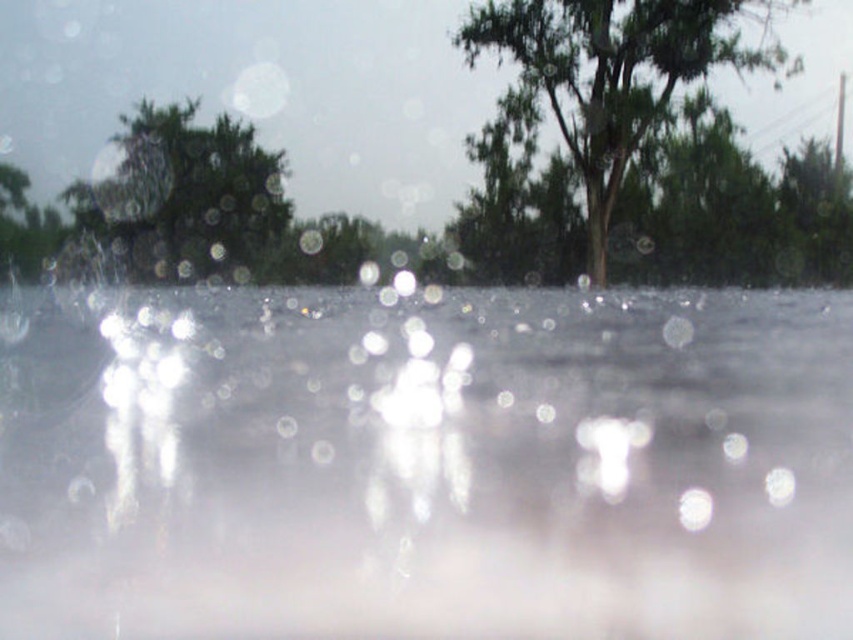
Which of these two, transparent water at center or green matte tree at upper left, stands shorter?

transparent water at center

Can you confirm if transparent water at center is positioned to the left of green matte tree at upper left?

No, transparent water at center is not to the left of green matte tree at upper left.

This screenshot has height=640, width=853. What do you see at coordinates (425, 465) in the screenshot? I see `transparent water at center` at bounding box center [425, 465].

Find the location of a particular element. transparent water at center is located at coordinates (425, 465).

Is transparent water at center below green leafy tree at upper center?

Correct, transparent water at center is located below green leafy tree at upper center.

Which is in front, point (123, 584) or point (585, 76)?

Point (123, 584) is more forward.

Find the location of `transparent water at center`. transparent water at center is located at coordinates (425, 465).

Can you confirm if green leafy tree at upper center is thinner than green matte tree at upper left?

No, green leafy tree at upper center is not thinner than green matte tree at upper left.

Is point (595, 97) positioned behind point (142, 256)?

No, (595, 97) is in front of (142, 256).

This screenshot has height=640, width=853. Find the location of `green leafy tree at upper center`. green leafy tree at upper center is located at coordinates (613, 76).